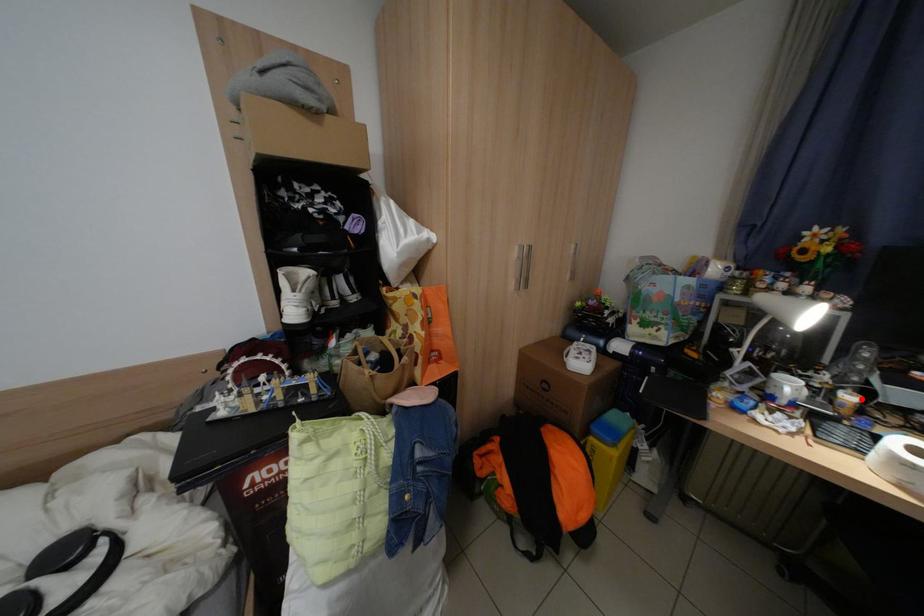
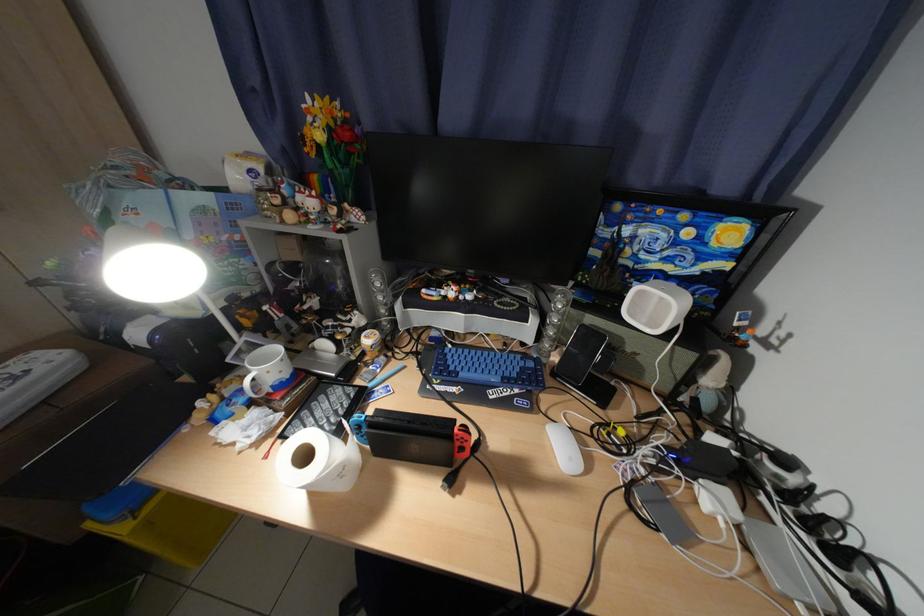
Where in the second image is the point corresponding to the highlighted location from the first image?

(381, 341)